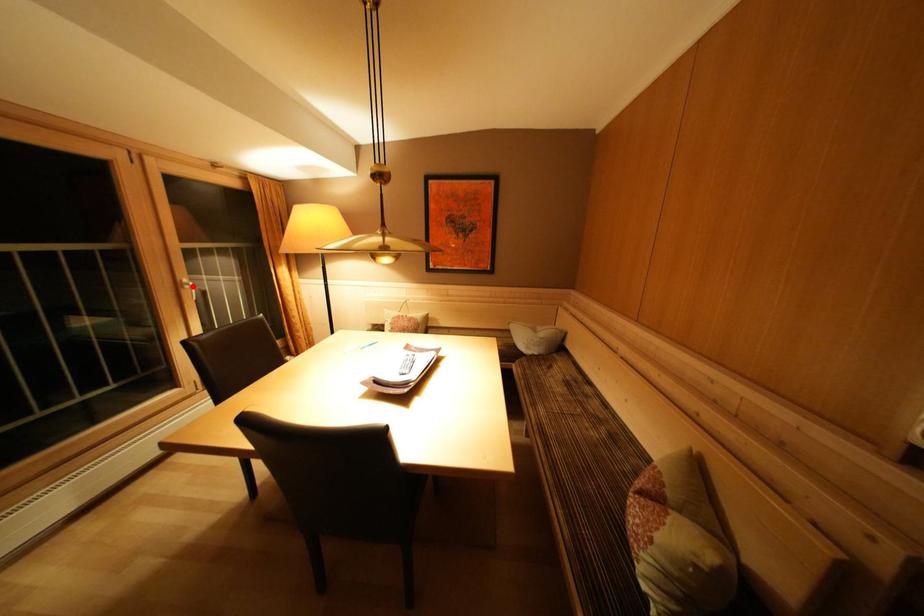
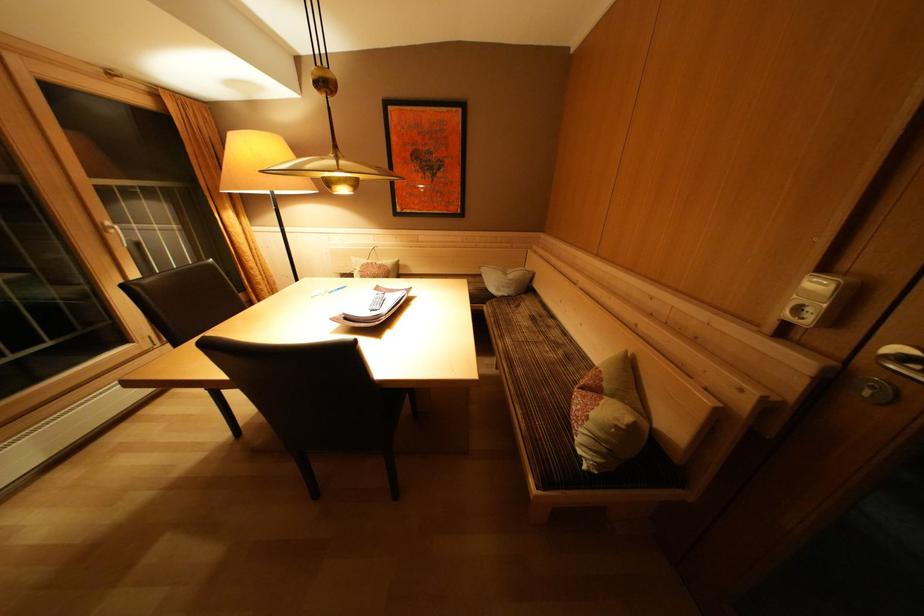
Where in the second image is the point corresponding to the highlighted location from the first image?

(116, 229)